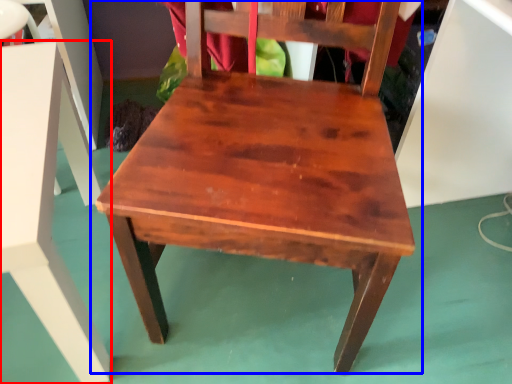
Question: Which point is closer to the camera, table (highlighted by a red box) or chair (highlighted by a blue box)?

Choices:
 (A) table
 (B) chair

Answer: (B)